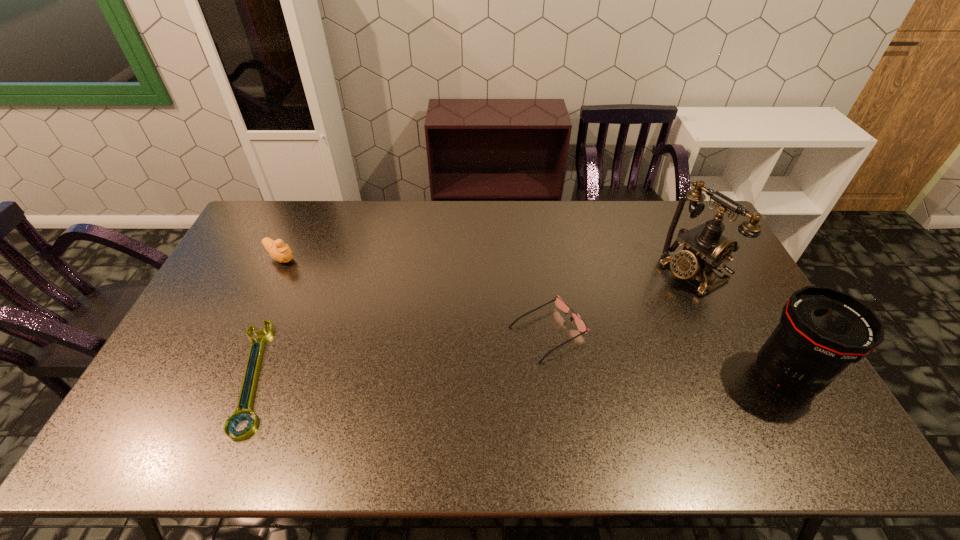
Identify the location of vacant space situated on the bridge of the sunglasses. (413, 402).

You are a GUI agent. You are given a task and a screenshot of the screen. Output one action in this format:
    pyautogui.click(x=<x>, y=<y>)
    Task: Click on the vacant space positioned on the face of the duckling
    This screenshot has width=960, height=540.
    Given the screenshot: What is the action you would take?
    pyautogui.click(x=374, y=315)

Locate an element on the screen. vacant space located 0.250m on the face of the duckling is located at coordinates (342, 295).

Locate an element on the screen. This screenshot has height=540, width=960. vacant position located on the face of the duckling is located at coordinates (319, 280).

You are a GUI agent. You are given a task and a screenshot of the screen. Output one action in this format:
    pyautogui.click(x=<x>, y=<y>)
    Task: Click on the free region located 0.380m on the rotary dial of the telephone
    Image resolution: width=960 pixels, height=540 pixels.
    Given the screenshot: What is the action you would take?
    pyautogui.click(x=579, y=335)

Image resolution: width=960 pixels, height=540 pixels. Identify the location of free space located on the rotary dial of the telephone. (592, 328).

What are the coordinates of `vacant position located 0.190m on the rotary dial of the telephone` in the screenshot? It's located at (628, 309).

The width and height of the screenshot is (960, 540). I want to click on wrench positioned at the near edge, so click(x=238, y=415).

In order to click on telephoto lens located at the near edge in this screenshot , I will do `click(822, 330)`.

Find the location of a particular element. object at the left edge is located at coordinates (281, 252).